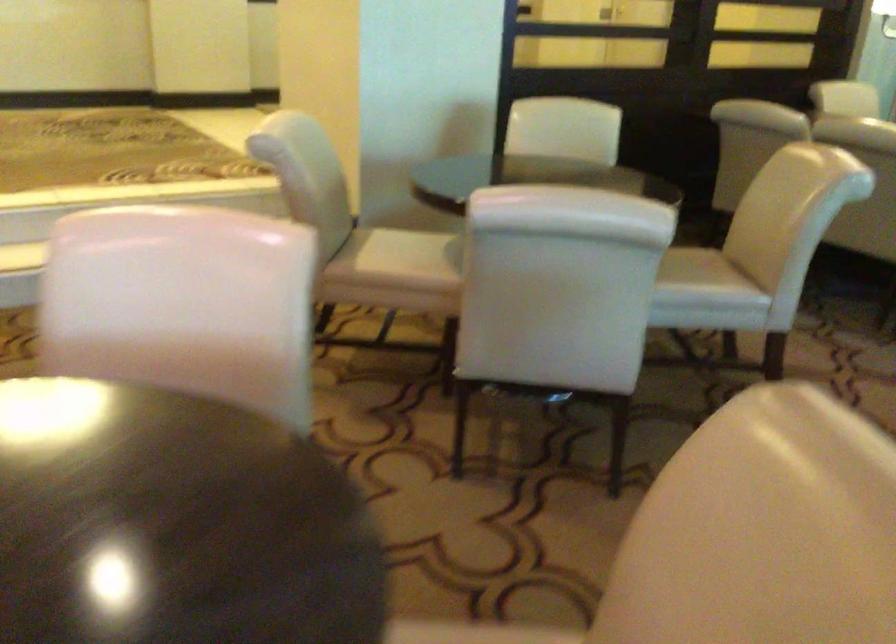
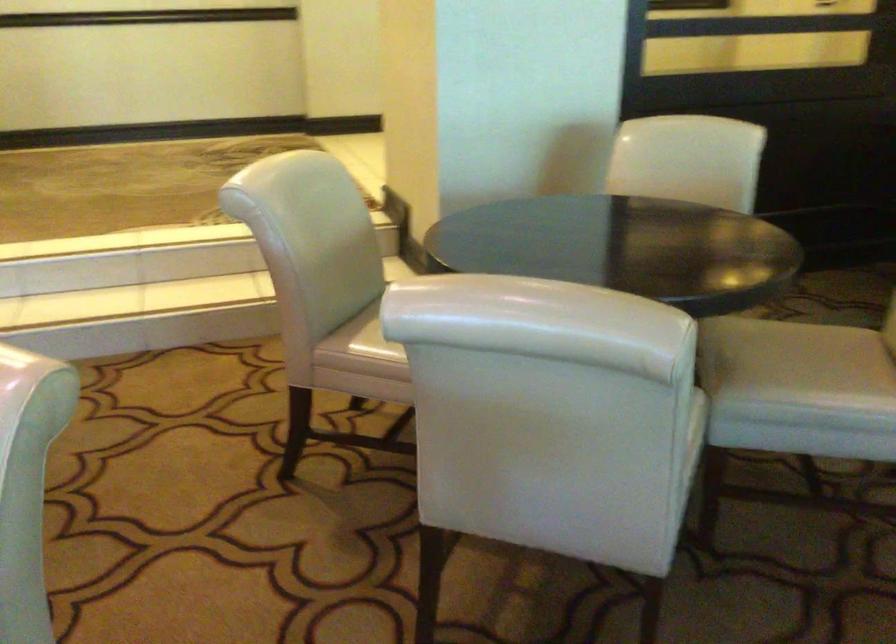
In the second image, find the point that corresponds to pixel 679 265 in the first image.

(796, 363)